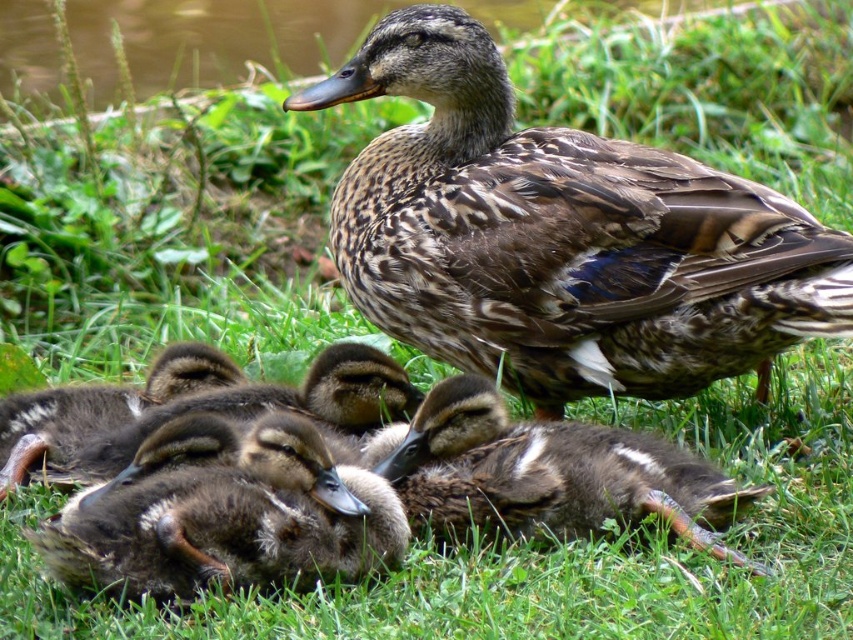
Question: Which object appears closest to the camera in this image?

Choices:
 (A) brown fluffy duckling at lower center
 (B) brown speckled feathers at center
 (C) brown downy duckling at center

Answer: (A)

Question: Which is nearer to the brown downy duckling at center?

Choices:
 (A) brown fluffy duckling at lower center
 (B) brown speckled feathers at center

Answer: (A)

Question: Does brown speckled feathers at center have a greater width compared to brown downy duckling at center?

Choices:
 (A) yes
 (B) no

Answer: (A)

Question: Is brown speckled feathers at center positioned in front of brown fluffy duckling at lower center?

Choices:
 (A) no
 (B) yes

Answer: (A)

Question: Is brown fluffy duckling at lower center to the left of brown downy duckling at center from the viewer's perspective?

Choices:
 (A) no
 (B) yes

Answer: (B)

Question: Which point is farther from the camera taking this photo?

Choices:
 (A) (703, 179)
 (B) (212, 422)

Answer: (A)